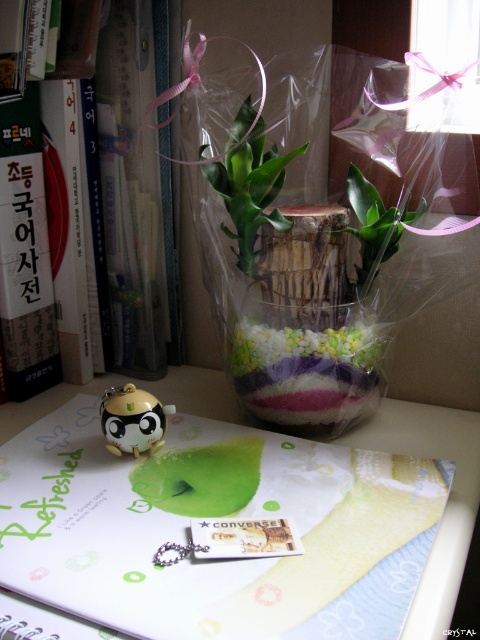
Which of these two, green matte notebook at center or translucent plastic plant at upper center, stands taller?

Standing taller between the two is green matte notebook at center.

Measure the distance between green matte notebook at center and camera.

green matte notebook at center is 25.69 inches from camera.

The image size is (480, 640). Identify the location of green matte notebook at center. (38, 227).

Can you confirm if green matte notebook at center is positioned below translucent plastic vase at center?

Incorrect, green matte notebook at center is not positioned below translucent plastic vase at center.

Does point (0, 77) lie in front of point (233, 364)?

Yes, point (0, 77) is in front of point (233, 364).

I want to click on green matte notebook at center, so click(38, 227).

Which is behind, point (369, 285) or point (137, 397)?

Point (369, 285)

Can you confirm if translucent plastic plant at upper center is positioned below matte yellow plastic panda at center?

No.

Is point (360, 173) more distant than point (132, 422)?

Yes, point (360, 173) is farther from viewer.

The width and height of the screenshot is (480, 640). Find the location of `translucent plastic plant at upper center`. translucent plastic plant at upper center is located at coordinates (373, 227).